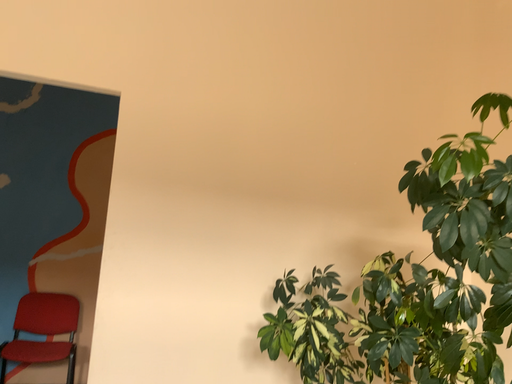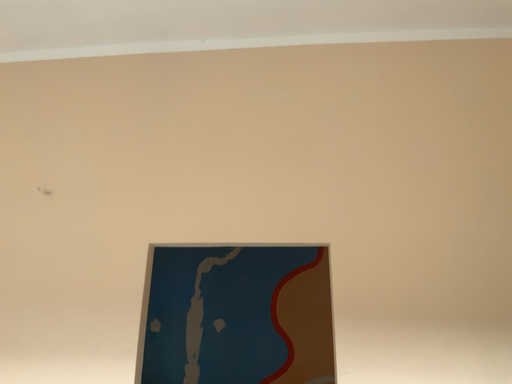
Question: Which way did the camera rotate in the video?

Choices:
 (A) rotated left
 (B) rotated right

Answer: (A)